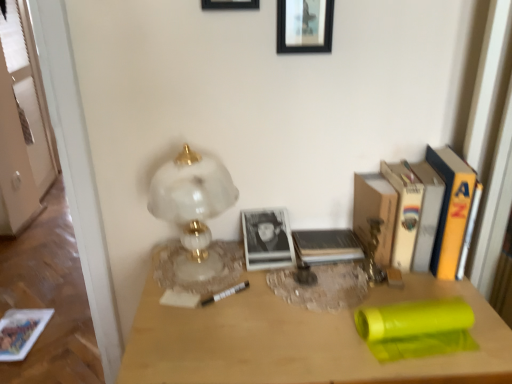
Question: Can you confirm if black matte picture frame at upper center, placed as the second picture frame when sorted from right to left, is positioned to the left of white paper at right, the fourth paperback book when ordered from left to right?

Choices:
 (A) yes
 (B) no

Answer: (A)

Question: From a real-world perspective, is black matte picture frame at upper center, which appears as the first picture frame when viewed from the left, beneath white paper at right, which appears as the 2th paperback book when viewed from the right?

Choices:
 (A) no
 (B) yes

Answer: (A)

Question: From the image's perspective, does black matte picture frame at upper center, placed as the second picture frame when sorted from right to left, appear higher than white paper at right, which appears as the 2th paperback book when viewed from the right?

Choices:
 (A) yes
 (B) no

Answer: (A)

Question: From the image's perspective, does black matte picture frame at upper center, placed as the second picture frame when sorted from right to left, appear lower than white paper at right, which appears as the 2th paperback book when viewed from the right?

Choices:
 (A) no
 (B) yes

Answer: (A)

Question: Is black matte picture frame at upper center, placed as the second picture frame when sorted from right to left, at the right side of white paper at right, the fourth paperback book when ordered from left to right?

Choices:
 (A) yes
 (B) no

Answer: (B)

Question: Is hardcover book at center, positioned as the first paperback book in left-to-right order, wider or thinner than black matte picture frame at upper center, placed as the second picture frame when sorted from right to left?

Choices:
 (A) wide
 (B) thin

Answer: (A)

Question: From the image's perspective, is hardcover book at center, positioned as the first paperback book in left-to-right order, located above or below black matte picture frame at upper center, which appears as the first picture frame when viewed from the left?

Choices:
 (A) above
 (B) below

Answer: (B)

Question: Is hardcover book at center, which is the 5th paperback book in right-to-left order, taller or shorter than black matte picture frame at upper center, which appears as the first picture frame when viewed from the left?

Choices:
 (A) tall
 (B) short

Answer: (B)

Question: Is point (345, 259) closer or farther from the camera than point (239, 3)?

Choices:
 (A) farther
 (B) closer

Answer: (A)

Question: Is black matte picture frame at upper center, which appears as the first picture frame when viewed from the left, taller or shorter than hardcover book at right, the 3th paperback book when ordered from right to left?

Choices:
 (A) short
 (B) tall

Answer: (A)

Question: Does point (223, 0) appear closer or farther from the camera than point (409, 264)?

Choices:
 (A) closer
 (B) farther

Answer: (A)

Question: Considering the relative positions of black matte picture frame at upper center, placed as the second picture frame when sorted from right to left, and hardcover book at right, acting as the 3th paperback book starting from the left, in the image provided, is black matte picture frame at upper center, placed as the second picture frame when sorted from right to left, to the left or to the right of hardcover book at right, acting as the 3th paperback book starting from the left,?

Choices:
 (A) left
 (B) right

Answer: (A)

Question: Considering the positions of black matte picture frame at upper center, placed as the second picture frame when sorted from right to left, and hardcover book at right, the 3th paperback book when ordered from right to left, in the image, is black matte picture frame at upper center, placed as the second picture frame when sorted from right to left, wider or thinner than hardcover book at right, the 3th paperback book when ordered from right to left,?

Choices:
 (A) wide
 (B) thin

Answer: (B)

Question: Is white marble lamp at left in front of or behind matte paper book at lower left in the image?

Choices:
 (A) behind
 (B) front

Answer: (B)

Question: Looking at the image, does white marble lamp at left seem bigger or smaller compared to matte paper book at lower left?

Choices:
 (A) small
 (B) big

Answer: (B)